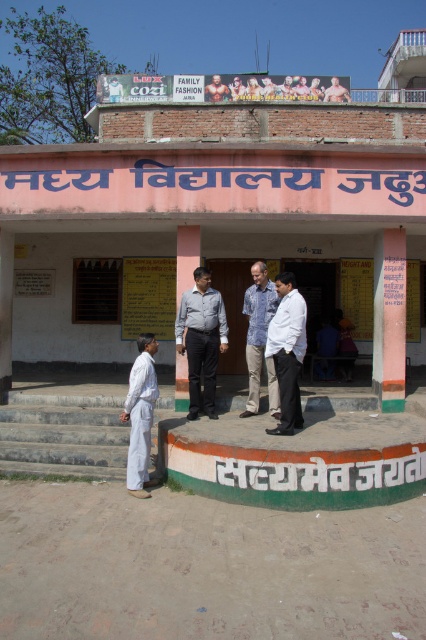
Is the position of orange painted pillar at right less distant than that of blue cotton shirt at center?

No, it is not.

Is point (385, 269) closer to camera compared to point (249, 368)?

No, it is behind (249, 368).

Who is more distant from viewer, (382, 340) or (247, 342)?

The point (247, 342) is behind.

The image size is (426, 640). What are the coordinates of `orange painted pillar at right` in the screenshot? It's located at (389, 317).

From the picture: Between light gray shirt at center and matte gray pillar at center, which one appears on the left side from the viewer's perspective?

matte gray pillar at center

Is light gray shirt at center thinner than matte gray pillar at center?

In fact, light gray shirt at center might be wider than matte gray pillar at center.

The image size is (426, 640). What do you see at coordinates (201, 339) in the screenshot? I see `light gray shirt at center` at bounding box center [201, 339].

Where is `light gray shirt at center`? The height and width of the screenshot is (640, 426). light gray shirt at center is located at coordinates (201, 339).

This screenshot has height=640, width=426. What do you see at coordinates (201, 339) in the screenshot?
I see `light gray shirt at center` at bounding box center [201, 339].

Is point (219, 307) farther from viewer compared to point (299, 348)?

Yes, point (219, 307) is farther from viewer.

What are the coordinates of `light gray shirt at center` in the screenshot? It's located at (201, 339).